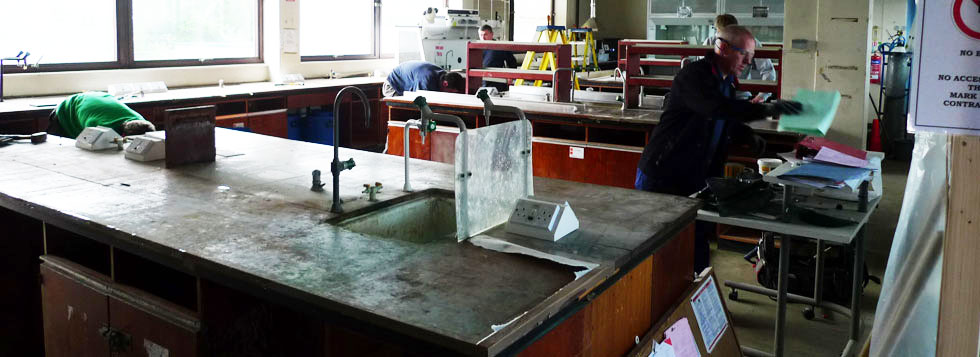
Locate an element on the screen. The image size is (980, 357). countertops is located at coordinates (239, 217), (589, 110), (603, 78).